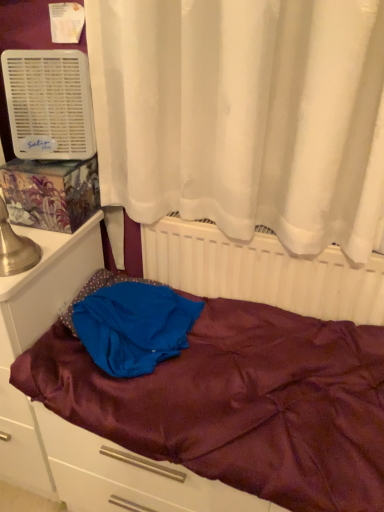
Identify the location of free space above white plastic radiator at center (from a real-world perspective). The width and height of the screenshot is (384, 512). [x=221, y=225].